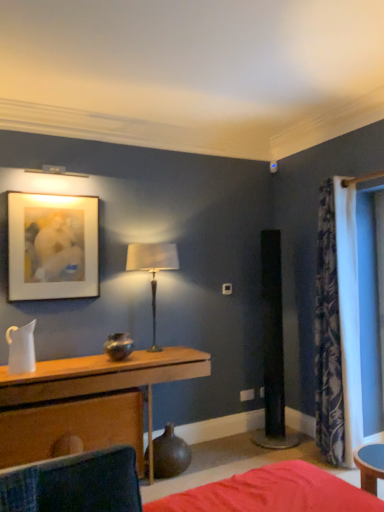
Image resolution: width=384 pixels, height=512 pixels. I want to click on free space above matte white picture frame at upper left (from a real-world perspective), so (56, 189).